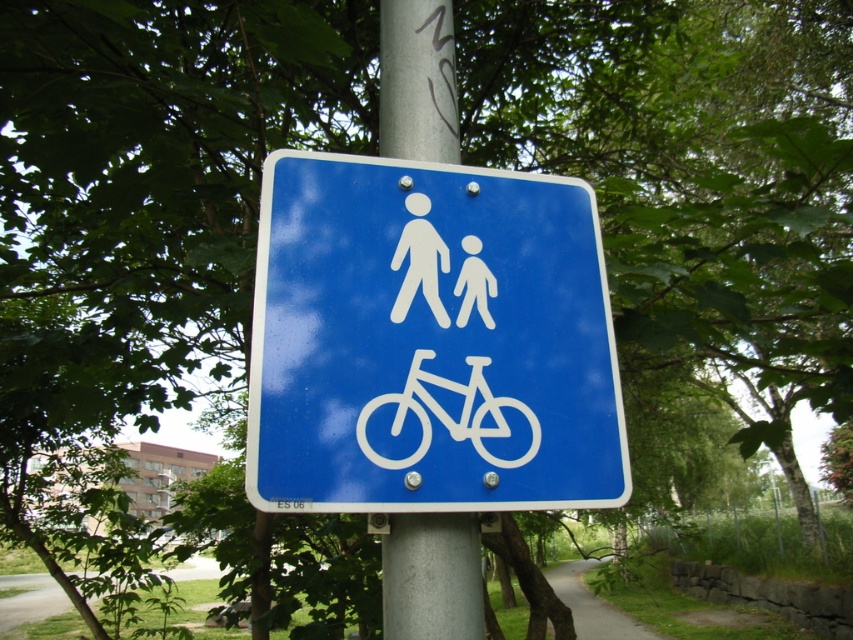
Question: Is silver metallic pole at center bigger than white matte figure at center?

Choices:
 (A) no
 (B) yes

Answer: (B)

Question: Is silver metallic pole at center thinner than white matte figure at center?

Choices:
 (A) no
 (B) yes

Answer: (A)

Question: Considering the real-world distances, which object is farthest from the white plastic bicycle at center?

Choices:
 (A) blue plastic sign at center
 (B) silver metallic pole at center
 (C) white matte figure at center

Answer: (B)

Question: Is silver metallic pole at center above white plastic bicycle at center?

Choices:
 (A) yes
 (B) no

Answer: (A)

Question: Which object is closer to the camera taking this photo?

Choices:
 (A) white plastic bicycle at center
 (B) blue plastic sign at center
 (C) silver metallic pole at center
 (D) white matte figure at center

Answer: (B)

Question: Among these points, which one is nearest to the camera?

Choices:
 (A) (430, 76)
 (B) (393, 256)

Answer: (B)